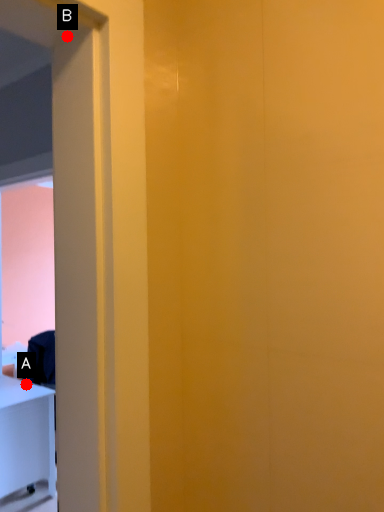
Question: Two points are circled on the image, labeled by A and B beside each circle. Among these points, which one is nearest to the camera?

Choices:
 (A) A is closer
 (B) B is closer

Answer: (B)